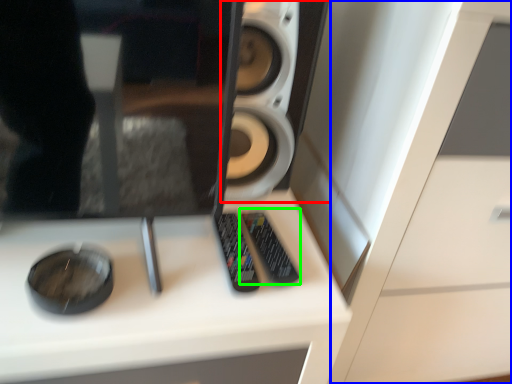
Question: Estimate the real-world distances between objects in this image. Which object is farther from speaker (highlighted by a red box), dresser (highlighted by a blue box) or control (highlighted by a green box)?

Choices:
 (A) dresser
 (B) control

Answer: (A)